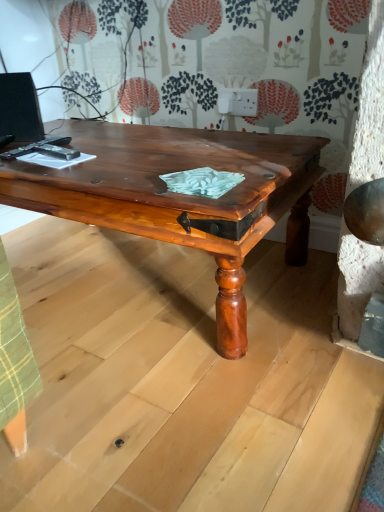
Question: From a real-world perspective, is matte black monitor at upper left physically above shiny brown wood coffee table at center?

Choices:
 (A) yes
 (B) no

Answer: (A)

Question: Considering the relative sizes of matte black monitor at upper left and shiny brown wood coffee table at center in the image provided, is matte black monitor at upper left shorter than shiny brown wood coffee table at center?

Choices:
 (A) yes
 (B) no

Answer: (A)

Question: Considering the relative sizes of matte black monitor at upper left and shiny brown wood coffee table at center in the image provided, is matte black monitor at upper left bigger than shiny brown wood coffee table at center?

Choices:
 (A) no
 (B) yes

Answer: (A)

Question: Can you confirm if matte black monitor at upper left is positioned to the right of shiny brown wood coffee table at center?

Choices:
 (A) yes
 (B) no

Answer: (B)

Question: Is matte black monitor at upper left aimed at shiny brown wood coffee table at center?

Choices:
 (A) no
 (B) yes

Answer: (A)

Question: Can you confirm if matte black monitor at upper left is positioned to the left of shiny brown wood coffee table at center?

Choices:
 (A) yes
 (B) no

Answer: (A)

Question: Could you tell me if shiny brown wood coffee table at center is facing matte black monitor at upper left?

Choices:
 (A) yes
 (B) no

Answer: (B)

Question: Does shiny brown wood coffee table at center come behind matte black monitor at upper left?

Choices:
 (A) yes
 (B) no

Answer: (B)

Question: Is shiny brown wood coffee table at center to the left of matte black monitor at upper left from the viewer's perspective?

Choices:
 (A) no
 (B) yes

Answer: (A)

Question: Does shiny brown wood coffee table at center contain matte black monitor at upper left?

Choices:
 (A) yes
 (B) no

Answer: (B)

Question: Does shiny brown wood coffee table at center have a greater width compared to matte black monitor at upper left?

Choices:
 (A) yes
 (B) no

Answer: (A)

Question: Is shiny brown wood coffee table at center turned away from matte black monitor at upper left?

Choices:
 (A) no
 (B) yes

Answer: (A)

Question: Is point (163, 126) positioned closer to the camera than point (14, 75)?

Choices:
 (A) farther
 (B) closer

Answer: (A)